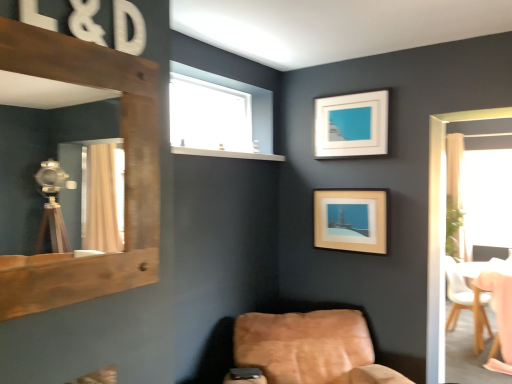
Question: Considering the relative positions of transparent glass window at upper center and wooden chair at lower right, the 3th chair when ordered from left to right, in the image provided, is transparent glass window at upper center in front of wooden chair at lower right, the 3th chair when ordered from left to right,?

Choices:
 (A) no
 (B) yes

Answer: (B)

Question: Is transparent glass window at upper center taller than wooden chair at lower right, which is the 1th chair in right-to-left order?

Choices:
 (A) no
 (B) yes

Answer: (A)

Question: Are transparent glass window at upper center and wooden chair at lower right, which is the 1th chair in right-to-left order, far apart?

Choices:
 (A) yes
 (B) no

Answer: (A)

Question: Is transparent glass window at upper center not within wooden chair at lower right, the 2th chair when ordered from back to front?

Choices:
 (A) no
 (B) yes

Answer: (B)

Question: From the image's perspective, is transparent glass window at upper center over wooden chair at lower right, the 3th chair when ordered from left to right?

Choices:
 (A) no
 (B) yes

Answer: (B)

Question: Considering the positions of leather at lower right, which is the third chair in back-to-front order, and white leather chair at right, which is the 3th chair from front to back, in the image, is leather at lower right, which is the third chair in back-to-front order, wider or thinner than white leather chair at right, which is the 3th chair from front to back,?

Choices:
 (A) wide
 (B) thin

Answer: (A)

Question: Is leather at lower right, acting as the 1th chair starting from the front, inside or outside of white leather chair at right, which is the 3th chair from front to back?

Choices:
 (A) inside
 (B) outside

Answer: (B)

Question: Is leather at lower right, marked as the 1th chair in a left-to-right arrangement, in front of or behind white leather chair at right, the second chair positioned from the right, in the image?

Choices:
 (A) behind
 (B) front

Answer: (B)

Question: Visually, is leather at lower right, which is the third chair in back-to-front order, positioned to the left or to the right of white leather chair at right, the second chair from the left?

Choices:
 (A) right
 (B) left

Answer: (B)

Question: Is point (461, 137) positioned closer to the camera than point (460, 294)?

Choices:
 (A) closer
 (B) farther

Answer: (B)

Question: From their relative heights in the image, would you say beige fabric curtain at right is taller or shorter than white leather chair at right, which is the 3th chair from front to back?

Choices:
 (A) short
 (B) tall

Answer: (B)

Question: In the image, is beige fabric curtain at right on the left side or the right side of white leather chair at right, which is the 3th chair from front to back?

Choices:
 (A) right
 (B) left

Answer: (A)

Question: Is beige fabric curtain at right situated inside white leather chair at right, the second chair from the left, or outside?

Choices:
 (A) outside
 (B) inside

Answer: (A)

Question: Visually, is transparent glass window at upper center positioned to the left or to the right of rustic wood mirror at left?

Choices:
 (A) left
 (B) right

Answer: (B)

Question: Is point (195, 144) closer or farther from the camera than point (117, 263)?

Choices:
 (A) closer
 (B) farther

Answer: (B)